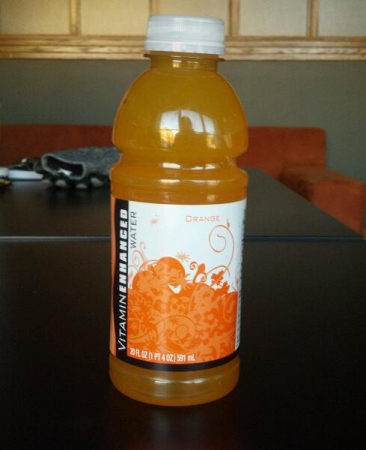
Where is `moulding`? This screenshot has width=366, height=450. moulding is located at coordinates (272, 50), (117, 39).